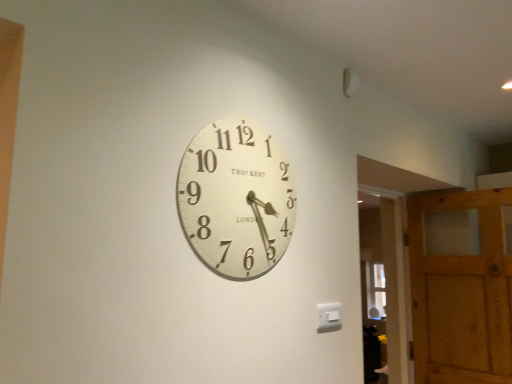
Describe the element at coordinates (384, 279) in the screenshot. The image size is (512, 384). I see `transparent glass door at right` at that location.

The width and height of the screenshot is (512, 384). I want to click on white matte clock at center, so click(x=236, y=199).

Would you say transparent glass door at right contains white matte clock at center?

No, white matte clock at center is not a part of transparent glass door at right.

In terms of width, does transparent glass door at right look wider or thinner when compared to white matte clock at center?

transparent glass door at right is wider than white matte clock at center.

Which is more distant, (391, 348) or (226, 168)?

The point (391, 348) is behind.

Which object is closer to the camera taking this photo, transparent glass door at right or white matte clock at center?

white matte clock at center.

Is point (220, 146) positioned behind point (403, 316)?

That is False.

Is transparent glass door at right completely or partially inside white matte clock at center?

No.

Does white matte clock at center have a larger size compared to transparent glass door at right?

Actually, white matte clock at center might be smaller than transparent glass door at right.

How far apart are white matte clock at center and wooden barn door at right?

white matte clock at center is 1.70 meters from wooden barn door at right.

Is white matte clock at center taller or shorter than wooden barn door at right?

Considering their sizes, white matte clock at center has less height than wooden barn door at right.

From a real-world perspective, who is located lower, white matte clock at center or wooden barn door at right?

wooden barn door at right, from a real-world perspective.

From the image's perspective, is white matte clock at center on top of wooden barn door at right?

Indeed, from the image's perspective, white matte clock at center is shown above wooden barn door at right.

Considering the relative sizes of transparent glass door at right and wooden barn door at right in the image provided, is transparent glass door at right bigger than wooden barn door at right?

No.

From a real-world perspective, is transparent glass door at right beneath wooden barn door at right?

No.

Based on the photo, from the image's perspective, is transparent glass door at right beneath wooden barn door at right?

No.

Is transparent glass door at right to the right of wooden barn door at right from the viewer's perspective?

No, transparent glass door at right is not to the right of wooden barn door at right.

From the image's perspective, between wooden barn door at right and transparent glass door at right, which one is located above?

From the image's view, transparent glass door at right is above.

The height and width of the screenshot is (384, 512). Identify the location of glass door that is behind the wooden barn door at right. (384, 279).

Can you confirm if wooden barn door at right is thinner than transparent glass door at right?

No, wooden barn door at right is not thinner than transparent glass door at right.

Is wooden barn door at right located outside transparent glass door at right?

wooden barn door at right lies outside transparent glass door at right's area.

From the image's perspective, who appears lower, wooden barn door at right or white matte clock at center?

wooden barn door at right, from the image's perspective.

Are wooden barn door at right and white matte clock at center beside each other?

There is a gap between wooden barn door at right and white matte clock at center.

Does point (507, 380) come behind point (239, 127)?

That is True.

This screenshot has height=384, width=512. In the image, there is a white matte clock at center. Identify the location of barn door below it (from a real-world perspective). (461, 286).

You are a GUI agent. You are given a task and a screenshot of the screen. Output one action in this format:
    pyautogui.click(x=<x>, y=<y>)
    Task: Click on the glass door that appears on the right of white matte clock at center
    The width and height of the screenshot is (512, 384).
    Given the screenshot: What is the action you would take?
    pyautogui.click(x=384, y=279)

Where is `glass door behind the white matte clock at center`? glass door behind the white matte clock at center is located at coordinates (384, 279).

Looking at this image, from the image, which object appears to be farther from wooden barn door at right, transparent glass door at right or white matte clock at center?

white matte clock at center is positioned further to the anchor wooden barn door at right.

When comparing their distances from white matte clock at center, does transparent glass door at right or wooden barn door at right seem closer?

Among the two, transparent glass door at right is located nearer to white matte clock at center.

From the image, which object appears to be farther from wooden barn door at right, white matte clock at center or transparent glass door at right?

white matte clock at center lies further to wooden barn door at right than the other object.

Based on their spatial positions, is wooden barn door at right or transparent glass door at right further from white matte clock at center?

wooden barn door at right lies further to white matte clock at center than the other object.

When comparing their distances from transparent glass door at right, does white matte clock at center or wooden barn door at right seem closer?

wooden barn door at right.

Consider the image. Looking at the image, which one is located further to transparent glass door at right, wooden barn door at right or white matte clock at center?

white matte clock at center is positioned further to the anchor transparent glass door at right.

Locate an element on the screen. The image size is (512, 384). barn door positioned between white matte clock at center and transparent glass door at right from near to far is located at coordinates (461, 286).